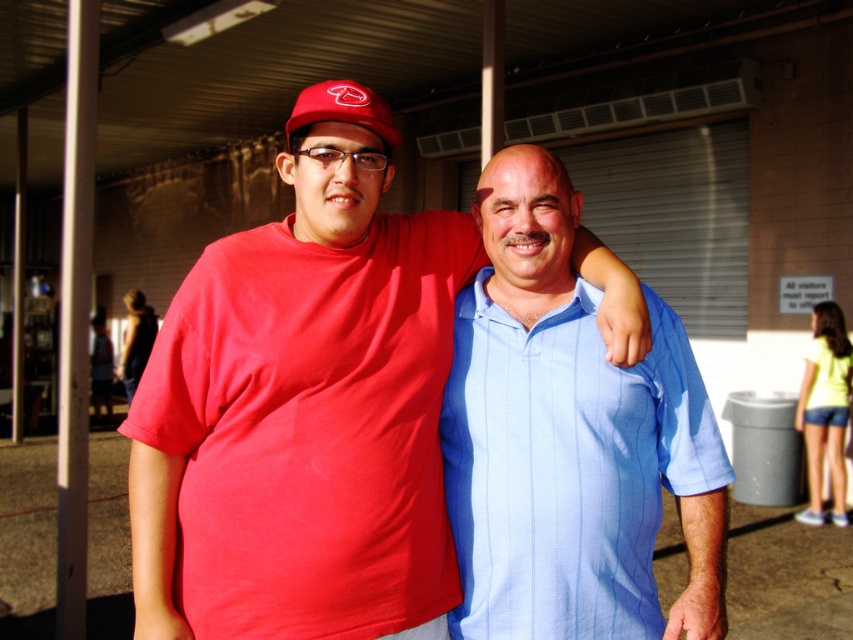
Is matte red shirt at center closer to camera compared to blue striped shirt at center?

Yes, matte red shirt at center is in front of blue striped shirt at center.

Is point (462, 260) positioned in front of point (578, 586)?

That is False.

Locate an element on the screen. matte red shirt at center is located at coordinates (302, 417).

Is matte red shirt at center below matte red baseball cap at upper center?

Indeed, matte red shirt at center is positioned under matte red baseball cap at upper center.

Which is above, matte red shirt at center or matte red baseball cap at upper center?

matte red baseball cap at upper center

Which is behind, point (287, 573) or point (366, 93)?

The point (366, 93) is behind.

The height and width of the screenshot is (640, 853). Find the location of `matte red shirt at center`. matte red shirt at center is located at coordinates (302, 417).

The image size is (853, 640). What do you see at coordinates (566, 467) in the screenshot?
I see `blue striped shirt at center` at bounding box center [566, 467].

Which is below, blue striped shirt at center or matte red baseball cap at upper center?

Positioned lower is blue striped shirt at center.

Is point (640, 524) positioned before point (370, 124)?

No, (640, 524) is further to viewer.

This screenshot has width=853, height=640. I want to click on blue striped shirt at center, so click(566, 467).